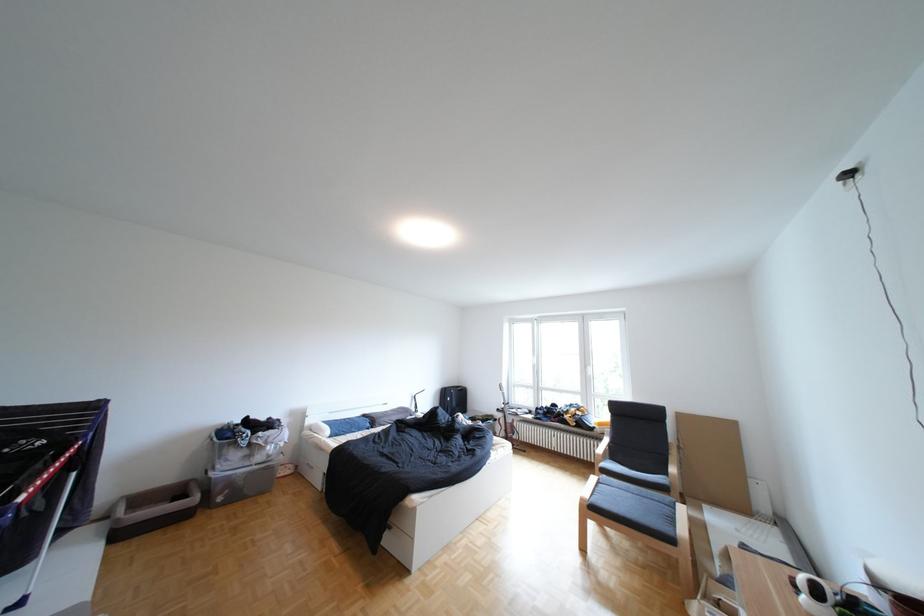
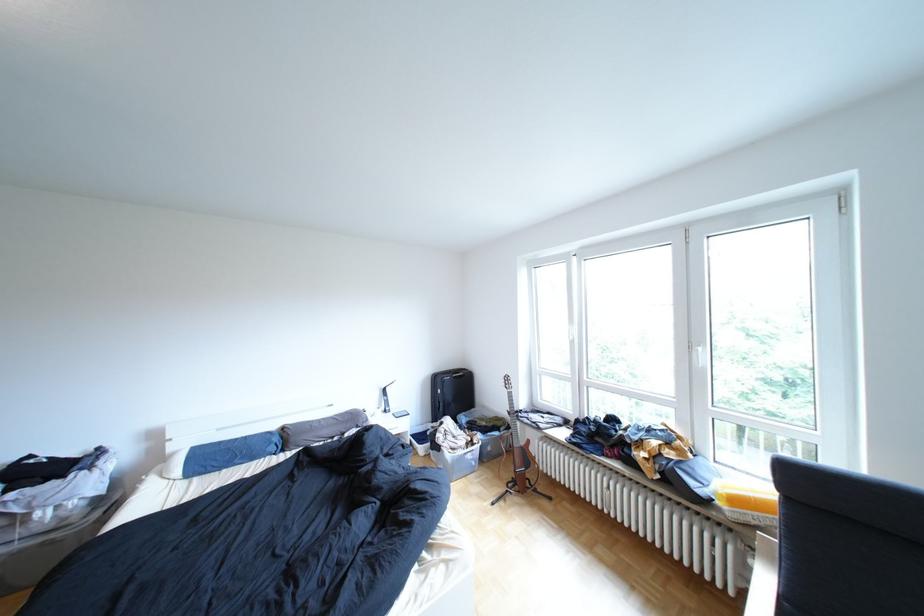
In the second image, find the point that corresponds to point (524, 426) in the first image.

(532, 453)